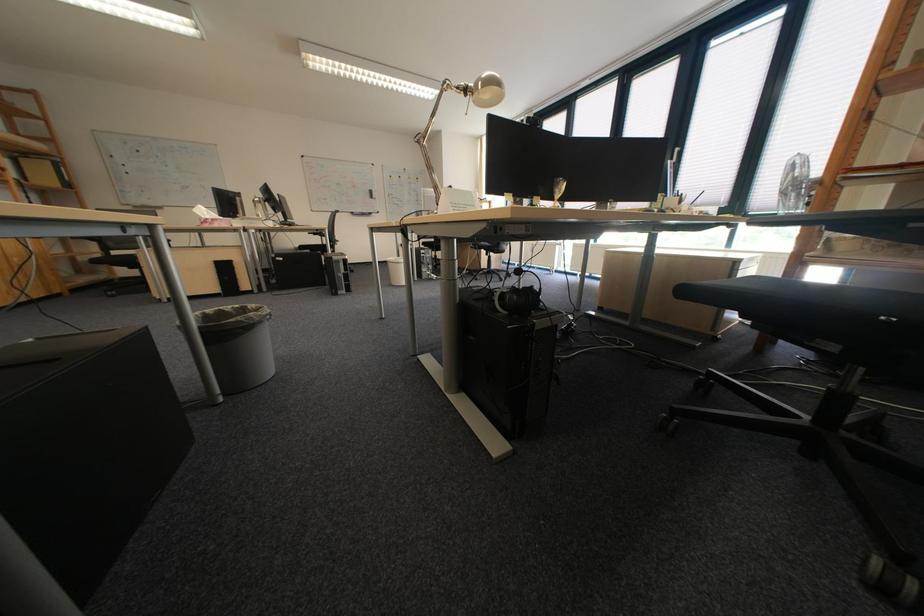
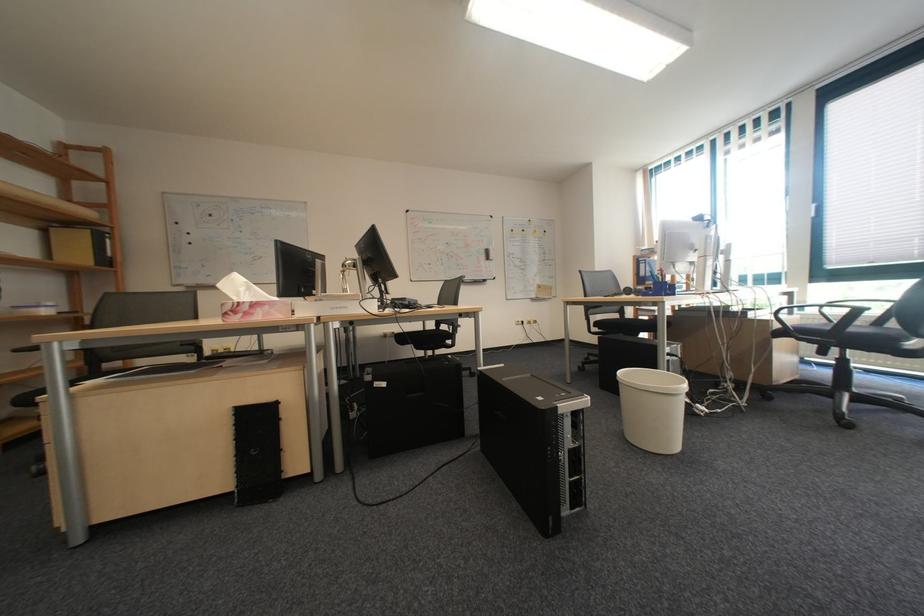
Where in the second image is the point corresponding to point 325,176 from the first image?

(431, 233)